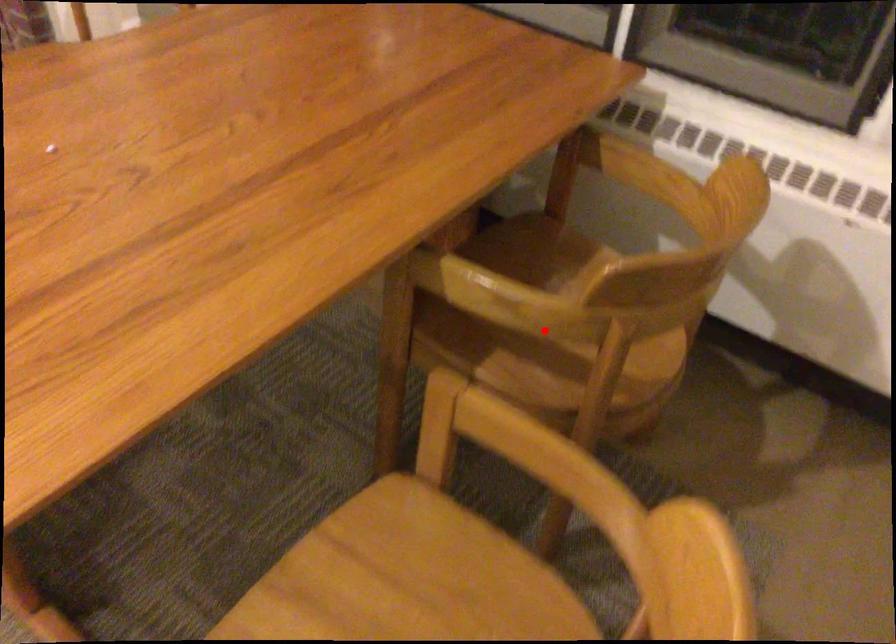
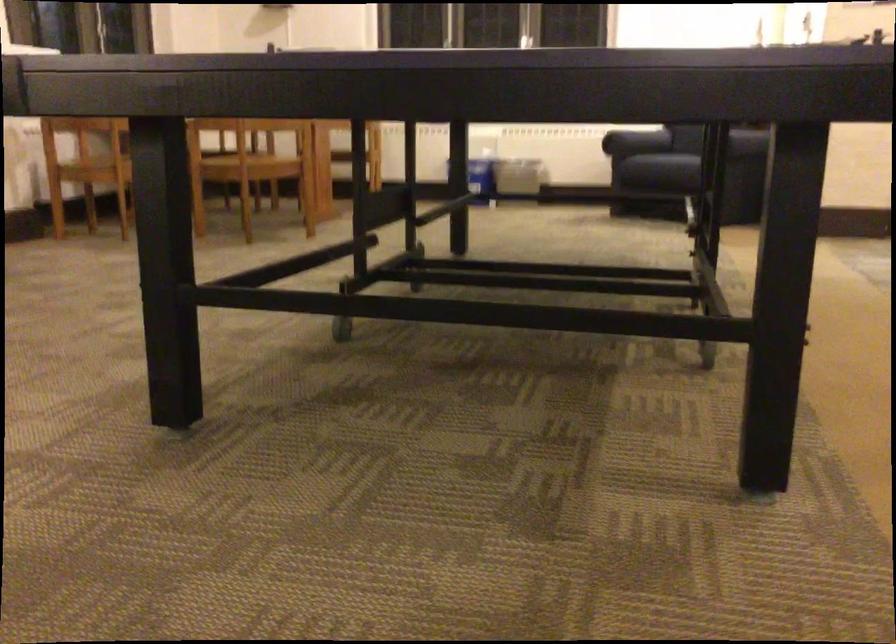
Question: I am providing you with two images of the same scene from different viewpoints. A red point is marked on the first image. At the location where the point appears in image 1, is it still visible in image 2?

Choices:
 (A) Yes
 (B) No

Answer: (B)